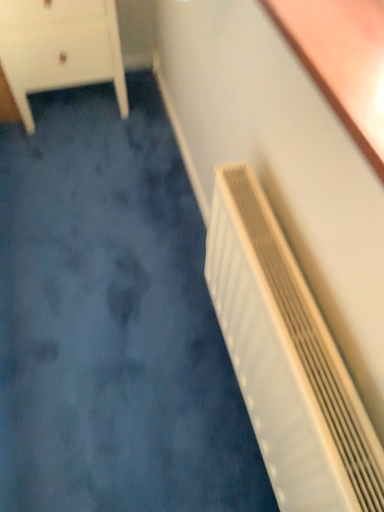
The width and height of the screenshot is (384, 512). What do you see at coordinates (60, 48) in the screenshot?
I see `white matte chest of drawers at upper left` at bounding box center [60, 48].

What is the approximate height of white matte chest of drawers at upper left?

It is 21.87 inches.

Locate an element on the screen. Image resolution: width=384 pixels, height=512 pixels. white matte chest of drawers at upper left is located at coordinates (60, 48).

Describe the element at coordinates (287, 360) in the screenshot. I see `white plastic radiator at right` at that location.

This screenshot has width=384, height=512. Identify the location of white plastic radiator at right. (287, 360).

At what (x,y) coordinates should I click in order to perform the action: click on white matte chest of drawers at upper left. Please return your answer as a coordinate pair (x, y). The image size is (384, 512). Looking at the image, I should click on (60, 48).

Considering the positions of objects white matte chest of drawers at upper left and white plastic radiator at right in the image provided, who is more to the right, white matte chest of drawers at upper left or white plastic radiator at right?

white plastic radiator at right is more to the right.

Considering the positions of objects white matte chest of drawers at upper left and white plastic radiator at right in the image provided, who is in front, white matte chest of drawers at upper left or white plastic radiator at right?

white plastic radiator at right is in front.

Is point (105, 31) positioned after point (280, 503)?

Yes, it is.

From the image's perspective, who appears lower, white matte chest of drawers at upper left or white plastic radiator at right?

From the image's view, white plastic radiator at right is below.

From a real-world perspective, is white matte chest of drawers at upper left on top of white plastic radiator at right?

No, from a real-world perspective, white matte chest of drawers at upper left is not on top of white plastic radiator at right.

Looking at their sizes, would you say white matte chest of drawers at upper left is wider or thinner than white plastic radiator at right?

In the image, white matte chest of drawers at upper left appears to be wider than white plastic radiator at right.

Is white matte chest of drawers at upper left shorter than white plastic radiator at right?

Indeed, white matte chest of drawers at upper left has a lesser height compared to white plastic radiator at right.

Considering the sizes of white matte chest of drawers at upper left and white plastic radiator at right in the image, is white matte chest of drawers at upper left bigger or smaller than white plastic radiator at right?

Clearly, white matte chest of drawers at upper left is larger in size than white plastic radiator at right.

Looking at this image, is white matte chest of drawers at upper left positioned beyond the bounds of white plastic radiator at right?

white matte chest of drawers at upper left is positioned outside white plastic radiator at right.

Is white matte chest of drawers at upper left beside white plastic radiator at right?

white matte chest of drawers at upper left is not next to white plastic radiator at right, and they're not touching.

Is white matte chest of drawers at upper left oriented away from white plastic radiator at right?

white matte chest of drawers at upper left does not have its back to white plastic radiator at right.

Identify the location of air conditioning in front of the white matte chest of drawers at upper left. point(287,360).

Would you say white plastic radiator at right is to the left or to the right of white matte chest of drawers at upper left in the picture?

Clearly, white plastic radiator at right is on the right of white matte chest of drawers at upper left in the image.

From the picture: Considering the positions of objects white plastic radiator at right and white matte chest of drawers at upper left in the image provided, who is in front, white plastic radiator at right or white matte chest of drawers at upper left?

white plastic radiator at right is closer to the camera.

Does point (313, 431) appear closer or farther from the camera than point (52, 29)?

Clearly, point (313, 431) is closer to the camera than point (52, 29).

From the image's perspective, who appears lower, white plastic radiator at right or white matte chest of drawers at upper left?

white plastic radiator at right appears lower in the image.

From a real-world perspective, is white plastic radiator at right above or below white matte chest of drawers at upper left?

white plastic radiator at right is situated higher than white matte chest of drawers at upper left in the real world.

Can you confirm if white plastic radiator at right is thinner than white matte chest of drawers at upper left?

Correct, the width of white plastic radiator at right is less than that of white matte chest of drawers at upper left.

From their relative heights in the image, would you say white plastic radiator at right is taller or shorter than white matte chest of drawers at upper left?

white plastic radiator at right is taller than white matte chest of drawers at upper left.

Is white plastic radiator at right smaller than white matte chest of drawers at upper left?

Yes, white plastic radiator at right is smaller than white matte chest of drawers at upper left.

Looking at this image, do you think white plastic radiator at right is within white matte chest of drawers at upper left, or outside of it?

white plastic radiator at right exists outside the volume of white matte chest of drawers at upper left.

Would you consider white plastic radiator at right to be distant from white matte chest of drawers at upper left?

white plastic radiator at right is far away from white matte chest of drawers at upper left.

Is white plastic radiator at right positioned with its back to white matte chest of drawers at upper left?

white plastic radiator at right does not have its back to white matte chest of drawers at upper left.

The width and height of the screenshot is (384, 512). I want to click on chest of drawers on the left side of white plastic radiator at right, so 60,48.

This screenshot has width=384, height=512. What are the coordinates of `the chest of drawers lying above the white plastic radiator at right (from the image's perspective)` in the screenshot? It's located at (60, 48).

Find the location of a particular element. chest of drawers on the left of white plastic radiator at right is located at coordinates (60, 48).